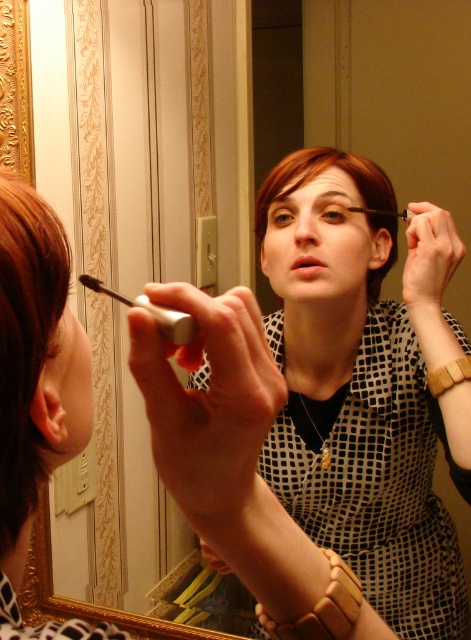
Which is in front, point (156, 314) or point (293, 262)?

Point (156, 314) is more forward.

Can you confirm if black matte mascara at upper center is positioned to the right of matte black lipstick at center?

Incorrect, black matte mascara at upper center is not on the right side of matte black lipstick at center.

Is point (170, 330) farther from viewer compared to point (306, 253)?

No.

Locate an element on the screen. The image size is (471, 640). black matte mascara at upper center is located at coordinates (151, 310).

Which is above, brown matte hair at left or brown matte eyebrow at upper center?

brown matte eyebrow at upper center

You are a GUI agent. You are given a task and a screenshot of the screen. Output one action in this format:
    pyautogui.click(x=<x>, y=<y>)
    Task: Click on the brown matte hair at left
    The height and width of the screenshot is (640, 471).
    Given the screenshot: What is the action you would take?
    pyautogui.click(x=25, y=340)

Who is lower down, brown matte hair at left or matte black lipstick at center?

brown matte hair at left is below.

Is brown matte hair at left to the right of matte black lipstick at center from the viewer's perspective?

In fact, brown matte hair at left is to the left of matte black lipstick at center.

Is point (40, 344) behind point (309, 266)?

No.

Where is `brown matte hair at left`? The image size is (471, 640). brown matte hair at left is located at coordinates (25, 340).